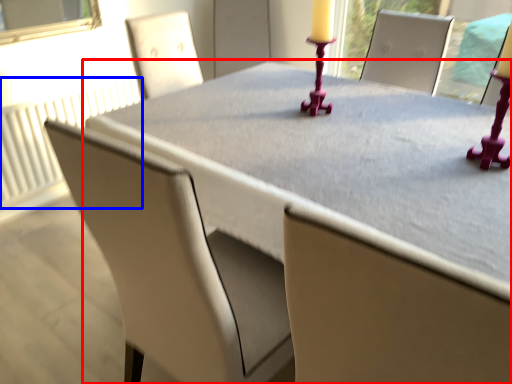
Question: Which object appears closest to the camera in this image, table (highlighted by a red box) or radiator (highlighted by a blue box)?

Choices:
 (A) table
 (B) radiator

Answer: (A)